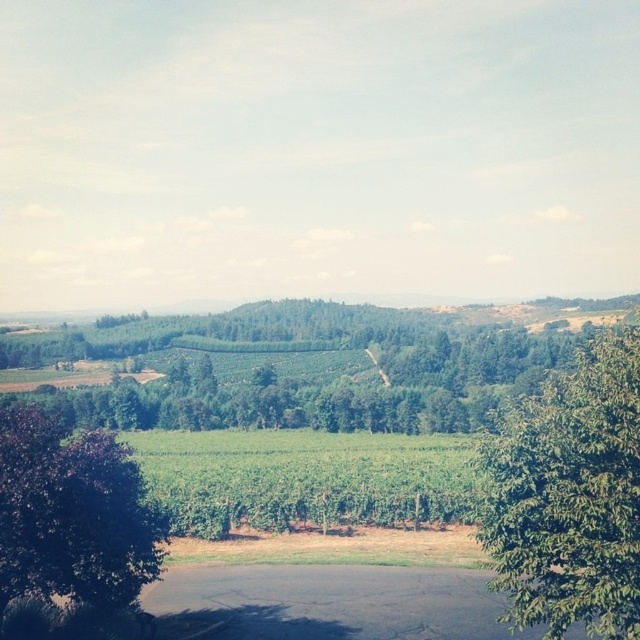
Who is more distant from viewer, (632, 397) or (419, 504)?

The point (419, 504) is more distant.

Is point (561, 400) farther from viewer compared to point (396, 444)?

No, it is not.

This screenshot has width=640, height=640. I want to click on green leafy tree at center-right, so click(x=570, y=497).

Based on the photo, who is positioned more to the right, green leafy trees at center or green leafy tree at center-right?

green leafy tree at center-right is more to the right.

Which is more to the left, green leafy trees at center or green leafy tree at center-right?

Positioned to the left is green leafy trees at center.

Locate an element on the screen. The height and width of the screenshot is (640, 640). green leafy trees at center is located at coordinates (310, 365).

How far apart are green leafy field at center and purple leafy tree at left?

The distance of green leafy field at center from purple leafy tree at left is 103.01 feet.

Identify the location of green leafy field at center. Image resolution: width=640 pixels, height=640 pixels. (305, 477).